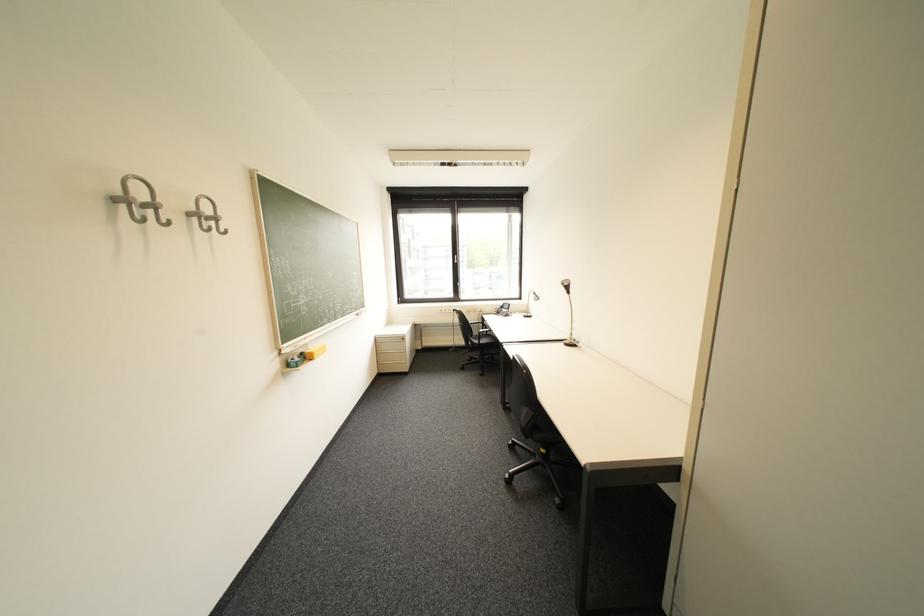
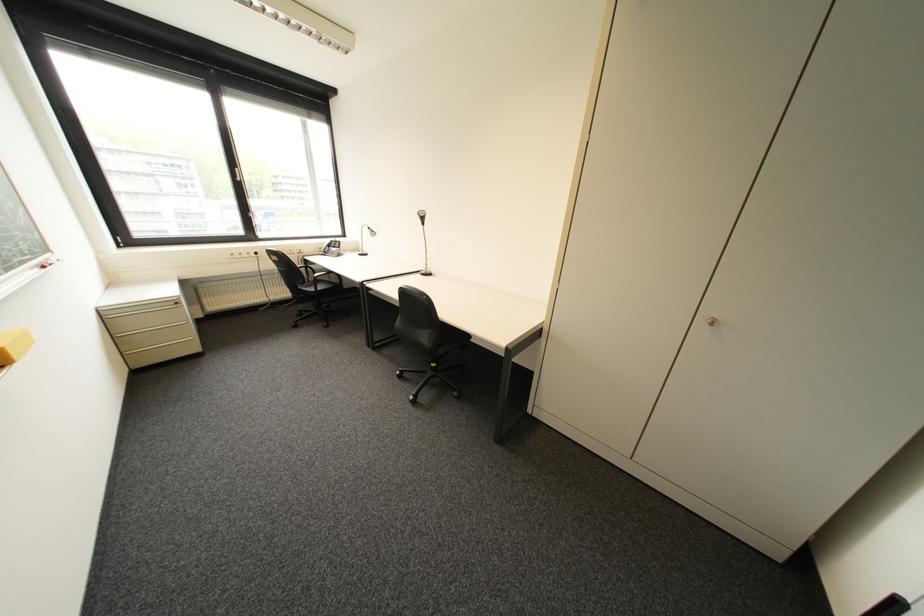
Where in the second image is the point corresponding to (530,313) from the first image?

(362, 252)